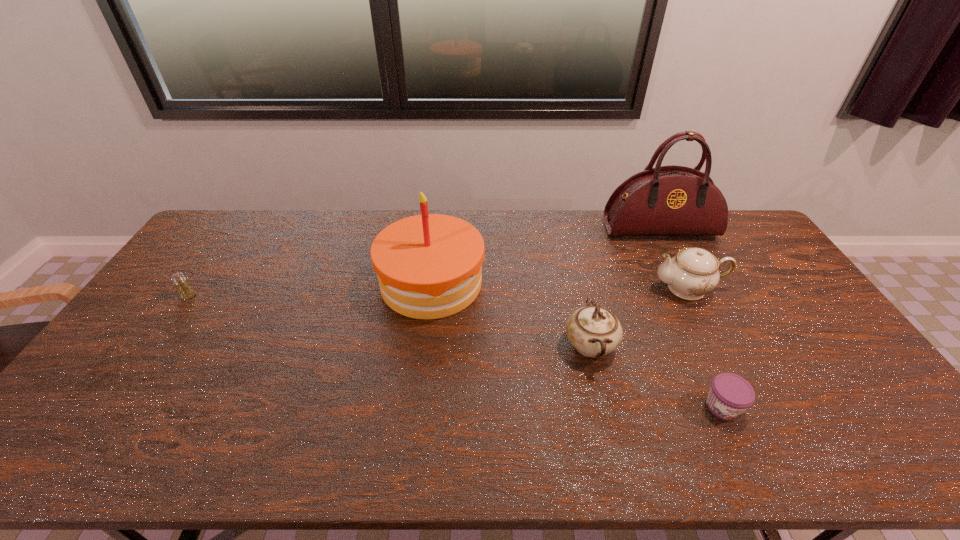
Identify the location of free spot at the left edge of the desktop. (113, 379).

Where is `vacant region at the far right corner of the desktop`? vacant region at the far right corner of the desktop is located at coordinates (753, 230).

Image resolution: width=960 pixels, height=540 pixels. In the image, there is a desktop. Find the location of `free space at the near right corner`. free space at the near right corner is located at coordinates pos(852,433).

The image size is (960, 540). In order to click on vacant space in between the handbag and the birthday cake in this screenshot , I will do `click(545, 256)`.

Locate an element on the screen. This screenshot has height=540, width=960. free spot between the fourth object from right to left and the fifth object from right to left is located at coordinates (511, 314).

Locate an element on the screen. The width and height of the screenshot is (960, 540). vacant point located between the nearer chinaware and the fifth object from right to left is located at coordinates (511, 314).

Image resolution: width=960 pixels, height=540 pixels. I want to click on vacant space that's between the saltshaker and the jam, so click(x=456, y=351).

Where is `free space between the jam and the fourth object from right to left`? free space between the jam and the fourth object from right to left is located at coordinates (657, 376).

This screenshot has height=540, width=960. In order to click on free point between the saltshaker and the left chinaware in this screenshot , I will do `click(389, 320)`.

Select which object appears as the second closest to the farther chinaware. Please provide its 2D coordinates. Your answer should be formatted as a tuple, i.e. [(x, y)], where the tuple contains the x and y coordinates of a point satisfying the conditions above.

[(594, 331)]